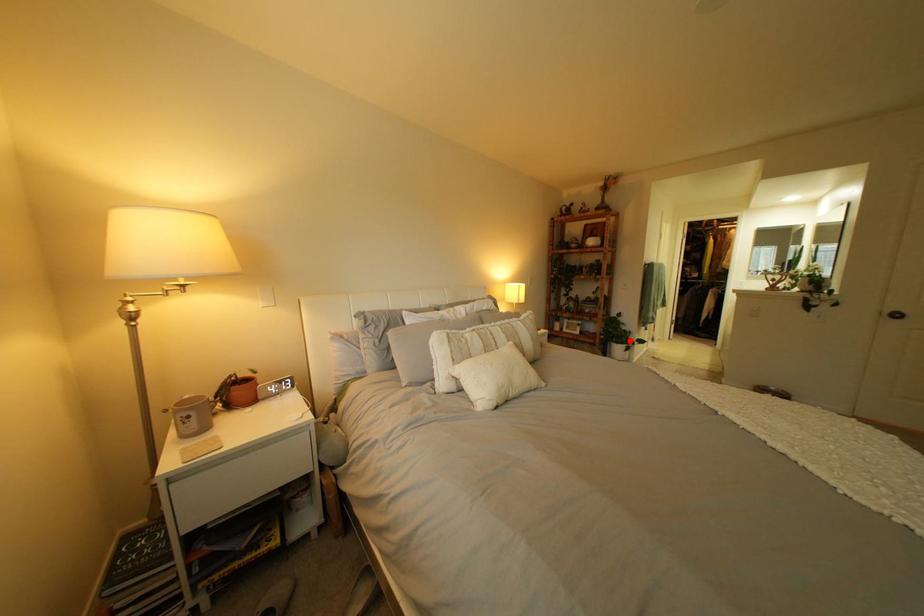
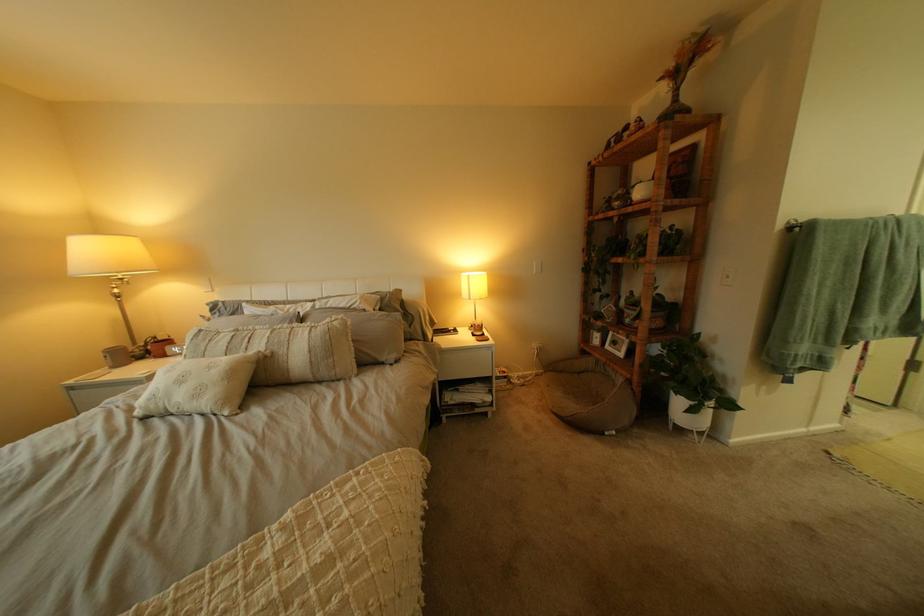
The point at the highlighted location is marked in the first image. Where is the corresponding point in the second image?

(687, 385)